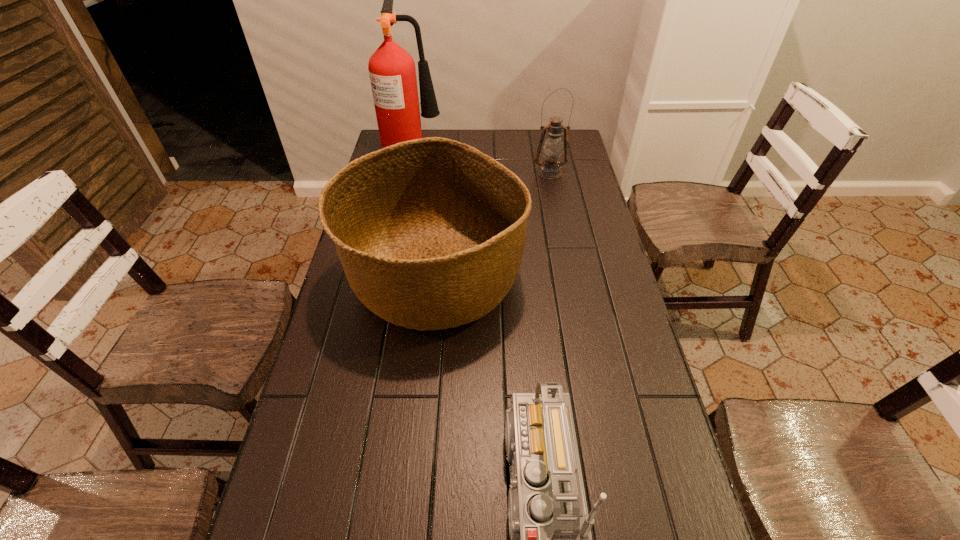
Identify the location of the tallest object. (392, 72).

Locate an element on the screen. This screenshot has height=540, width=960. fire extinguisher is located at coordinates [x=392, y=72].

At what (x,y) coordinates should I click in order to perform the action: click on oil lamp. Please return your answer as a coordinate pair (x, y). The image size is (960, 540). Looking at the image, I should click on (552, 149).

I want to click on the rightmost object, so click(552, 149).

What are the coordinates of `basket` in the screenshot? It's located at (430, 232).

This screenshot has width=960, height=540. I want to click on blank space located 0.380m at the nozzle of the tallest object, so click(533, 145).

This screenshot has height=540, width=960. I want to click on vacant space located on the front of the rightmost object, so click(554, 192).

Identify the location of free space located on the front of the basket. The image size is (960, 540). pos(423,400).

This screenshot has width=960, height=540. I want to click on object that is at the far edge, so click(392, 72).

This screenshot has width=960, height=540. In order to click on fire extinguisher present at the left edge in this screenshot , I will do 392,72.